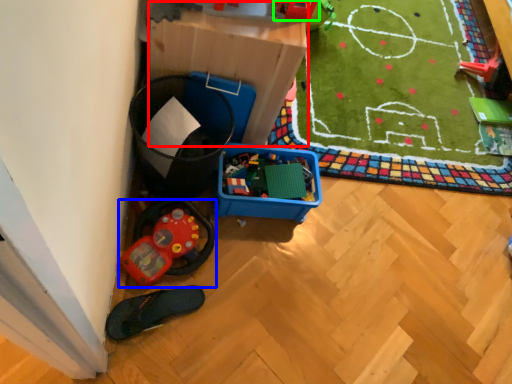
Question: Which object is positioned closest to storage box (highlighted by a red box)? Select from toy (highlighted by a blue box) and toy (highlighted by a green box).

Choices:
 (A) toy
 (B) toy

Answer: (B)